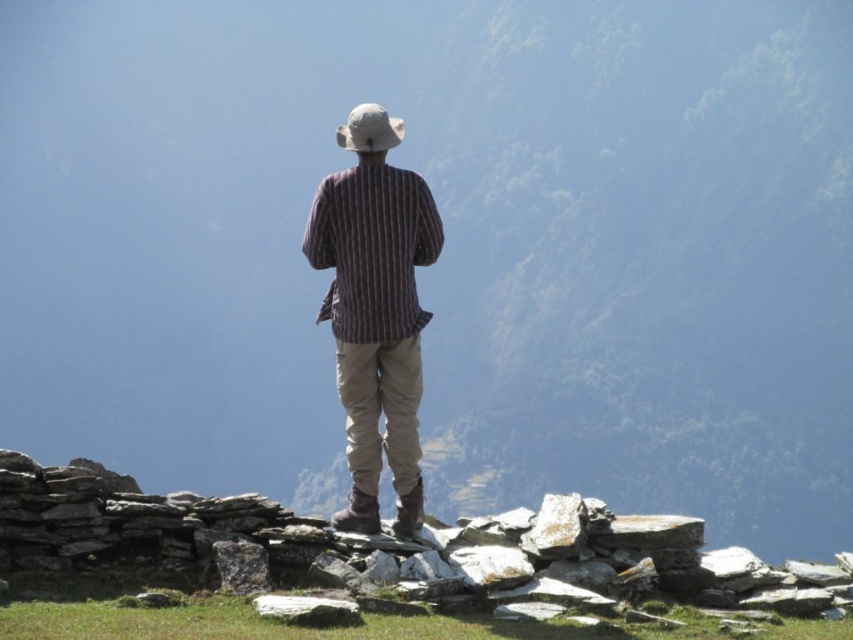
In the scene shown: Does striped cotton shirt at center have a greater height compared to white fabric hat at center?

Incorrect, striped cotton shirt at center's height is not larger of white fabric hat at center's.

Is striped cotton shirt at center smaller than white fabric hat at center?

Correct, striped cotton shirt at center occupies less space than white fabric hat at center.

Is point (399, 195) positioned after point (335, 129)?

No, it is not.

Locate an element on the screen. The width and height of the screenshot is (853, 640). striped cotton shirt at center is located at coordinates (372, 250).

Which is below, striped fabric shirt at center or striped cotton shirt at center?

striped cotton shirt at center is below.

Does striped fabric shirt at center come in front of striped cotton shirt at center?

No, it is behind striped cotton shirt at center.

Between point (344, 140) and point (408, 227), which one is positioned behind?

Positioned behind is point (344, 140).

The image size is (853, 640). What are the coordinates of `striped fabric shirt at center` in the screenshot? It's located at (375, 310).

Does striped fabric shirt at center appear over white fabric hat at center?

No.

Is striped fabric shirt at center wider than white fabric hat at center?

No, striped fabric shirt at center is not wider than white fabric hat at center.

Between point (387, 248) and point (350, 120), which one is positioned in front?

Positioned in front is point (387, 248).

At what (x,y) coordinates should I click in order to perform the action: click on striped fabric shirt at center. Please return your answer as a coordinate pair (x, y). The image size is (853, 640). Looking at the image, I should click on (375, 310).